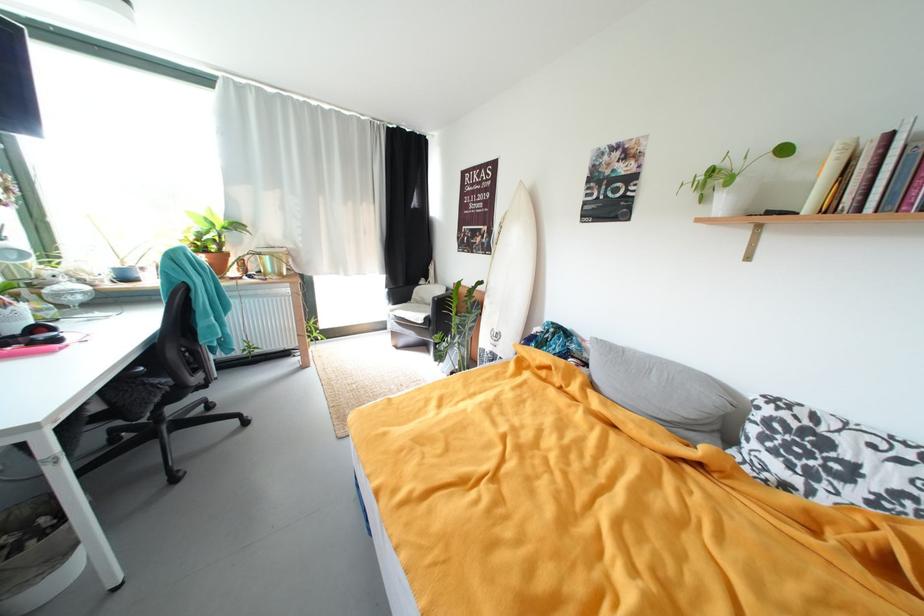
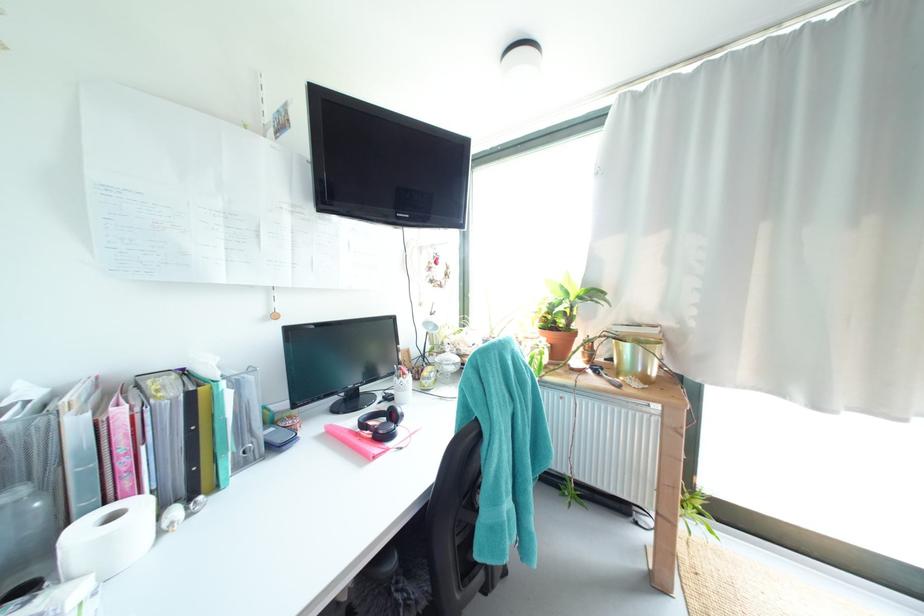
The point at (54, 293) is marked in the first image. Where is the corresponding point in the second image?

(445, 361)